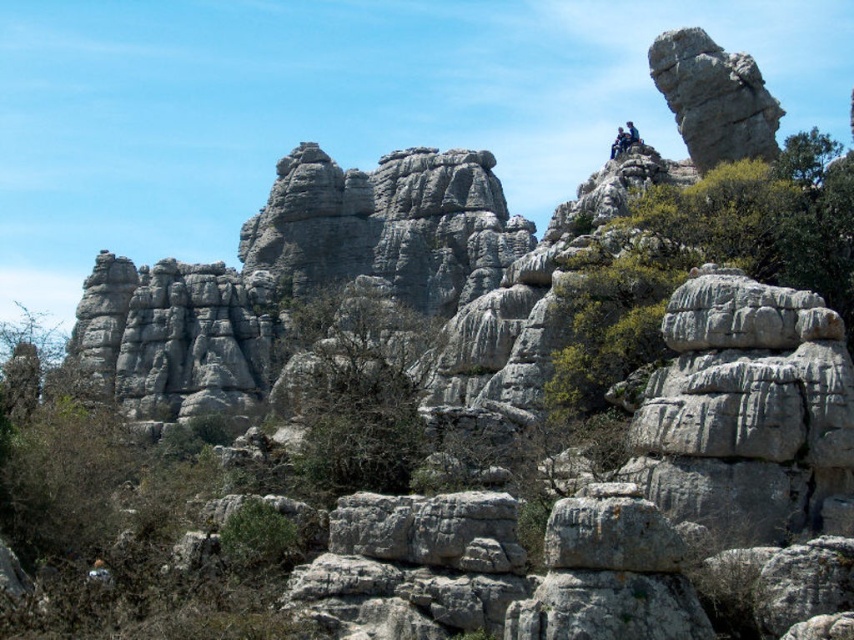
Question: Does green leafy shrub at upper right appear over green leafy tree at center?

Choices:
 (A) yes
 (B) no

Answer: (A)

Question: Which object is closer to the camera taking this photo?

Choices:
 (A) green leafy tree at center
 (B) dark blue jeans at upper center
 (C) gray rock formation at upper right

Answer: (A)

Question: Among these points, which one is farthest from the camera?

Choices:
 (A) (314, 324)
 (B) (747, 60)
 (C) (595, 304)
 (D) (619, 129)

Answer: (D)

Question: Does green leafy shrub at upper right have a lesser width compared to green leafy tree at center?

Choices:
 (A) yes
 (B) no

Answer: (A)

Question: Which point appears closest to the camera in this image?

Choices:
 (A) (621, 145)
 (B) (692, 209)
 (C) (422, 420)

Answer: (C)

Question: Does green leafy shrub at upper right have a smaller size compared to gray rock formation at upper right?

Choices:
 (A) yes
 (B) no

Answer: (B)